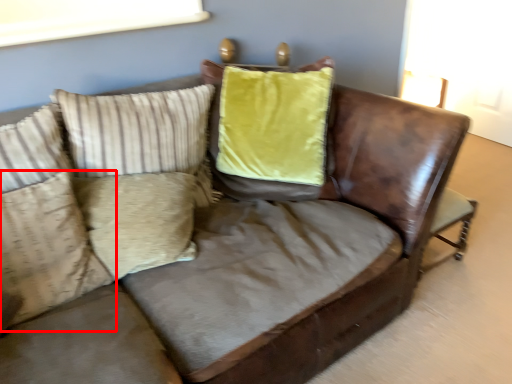
Question: From the image, what is the correct spatial relationship of pillow (annotated by the red box) in relation to pillow?

Choices:
 (A) left
 (B) right

Answer: (A)